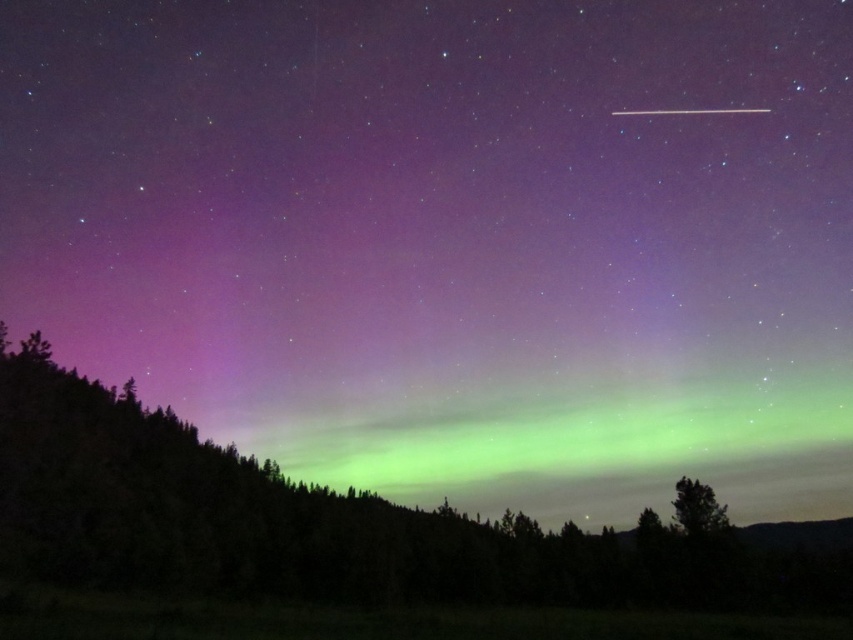
Can you confirm if green matte forest at lower center is positioned above green leafy tree at lower right?

No, green matte forest at lower center is not above green leafy tree at lower right.

In the scene shown: Does green matte forest at lower center appear under green leafy tree at lower right?

Correct, green matte forest at lower center is located below green leafy tree at lower right.

Is point (456, 545) positioned after point (682, 480)?

Yes, it is.

Image resolution: width=853 pixels, height=640 pixels. In order to click on green matte forest at lower center in this screenshot , I will do `click(331, 524)`.